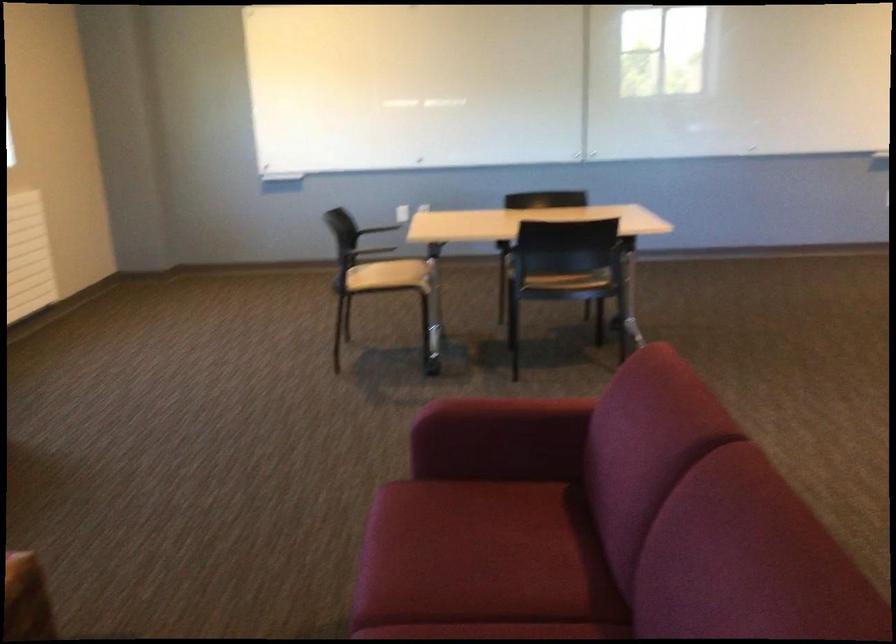
Describe the element at coordinates (389, 276) in the screenshot. This screenshot has height=644, width=896. I see `the tan chair sitting surface` at that location.